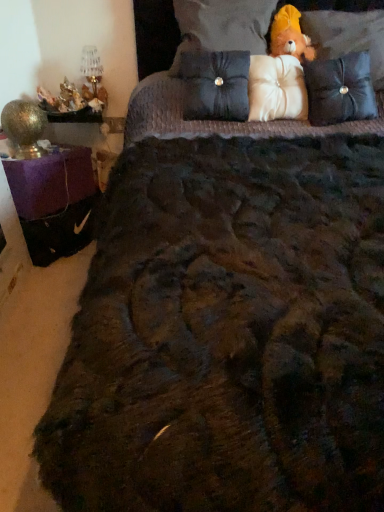
Question: Is white fabric pillow at center, the 3th pillow viewed from the right, turned away from velvet-like brown pillow at upper right, the fourth pillow positioned from the left?

Choices:
 (A) yes
 (B) no

Answer: (B)

Question: Is white fabric pillow at center, the 3th pillow viewed from the right, positioned behind velvet-like brown pillow at upper right, the fourth pillow positioned from the left?

Choices:
 (A) yes
 (B) no

Answer: (A)

Question: From a real-world perspective, is white fabric pillow at center, acting as the 3th pillow starting from the left, positioned under velvet-like brown pillow at upper right, the fourth pillow positioned from the left, based on gravity?

Choices:
 (A) yes
 (B) no

Answer: (A)

Question: Is white fabric pillow at center, the 3th pillow viewed from the right, taller than velvet-like brown pillow at upper right, the fourth pillow positioned from the left?

Choices:
 (A) no
 (B) yes

Answer: (A)

Question: Is velvet-like brown pillow at upper right, which is the second pillow in right-to-left order, located within white fabric pillow at center, the 3th pillow viewed from the right?

Choices:
 (A) yes
 (B) no

Answer: (B)

Question: Considering the positions of fuzzy brown teddy bear at upper right and velvet black pillow at upper right, which appears as the fifth pillow when viewed from the left, in the image, is fuzzy brown teddy bear at upper right wider or thinner than velvet black pillow at upper right, which appears as the fifth pillow when viewed from the left,?

Choices:
 (A) wide
 (B) thin

Answer: (B)

Question: Is fuzzy brown teddy bear at upper right spatially inside velvet black pillow at upper right, which ranks as the first pillow in right-to-left order, or outside of it?

Choices:
 (A) outside
 (B) inside

Answer: (B)

Question: In the image, is fuzzy brown teddy bear at upper right positioned in front of or behind velvet black pillow at upper right, which ranks as the first pillow in right-to-left order?

Choices:
 (A) behind
 (B) front

Answer: (A)

Question: From a real-world perspective, is fuzzy brown teddy bear at upper right positioned above or below velvet black pillow at upper right, which ranks as the first pillow in right-to-left order?

Choices:
 (A) below
 (B) above

Answer: (B)

Question: Considering their positions, is white fabric pillow at center, acting as the 3th pillow starting from the left, located in front of or behind velvet black pillow at upper right, which ranks as the first pillow in right-to-left order?

Choices:
 (A) behind
 (B) front

Answer: (A)

Question: Considering the positions of white fabric pillow at center, acting as the 3th pillow starting from the left, and velvet black pillow at upper right, which appears as the fifth pillow when viewed from the left, in the image, is white fabric pillow at center, acting as the 3th pillow starting from the left, bigger or smaller than velvet black pillow at upper right, which appears as the fifth pillow when viewed from the left,?

Choices:
 (A) small
 (B) big

Answer: (A)

Question: Do you think white fabric pillow at center, the 3th pillow viewed from the right, is within velvet black pillow at upper right, which ranks as the first pillow in right-to-left order, or outside of it?

Choices:
 (A) inside
 (B) outside

Answer: (B)

Question: Would you say white fabric pillow at center, acting as the 3th pillow starting from the left, is to the left or to the right of velvet black pillow at upper right, which ranks as the first pillow in right-to-left order, in the picture?

Choices:
 (A) left
 (B) right

Answer: (A)

Question: Is point (251, 58) positioned closer to the camera than point (215, 60)?

Choices:
 (A) closer
 (B) farther

Answer: (B)

Question: Considering their positions, is white fabric pillow at center, acting as the 3th pillow starting from the left, located in front of or behind black quilted pillow at center, the first pillow viewed from the left?

Choices:
 (A) behind
 (B) front

Answer: (A)